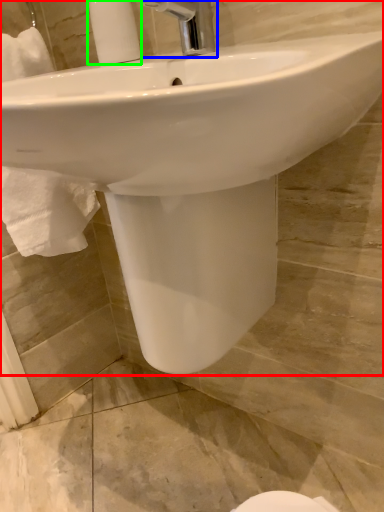
Question: Which object is positioned farthest from sink (highlighted by a red box)? Select from tap (highlighted by a blue box) and soap dispenser (highlighted by a green box).

Choices:
 (A) tap
 (B) soap dispenser

Answer: (B)